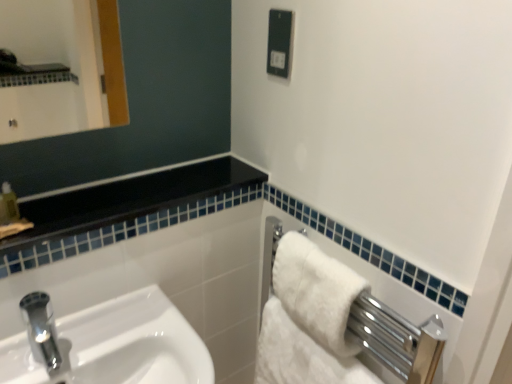
In order to face white fluffy bath towel at right, the 1th bath towel viewed from the top, should I rotate leftwards or rightwards?

Turn right approximately 8.119 degrees to face it.

Find the location of a particular element. The image size is (512, 384). black plastic electric outlet at upper center is located at coordinates (279, 42).

Where is `black glossy balustrade at upper left`? black glossy balustrade at upper left is located at coordinates (128, 200).

Find the location of a particular element. white fluffy bath towel at right, which is counted as the 2th bath towel, starting from the bottom is located at coordinates (316, 291).

Which bath towel is the 1st one when counting from the back of the black glossy balustrade at upper left? Please provide its 2D coordinates.

[(316, 291)]

Considering the relative positions of white fluffy bath towel at right, the 1th bath towel viewed from the top, and black glossy balustrade at upper left in the image provided, is white fluffy bath towel at right, the 1th bath towel viewed from the top, behind black glossy balustrade at upper left?

Yes, white fluffy bath towel at right, the 1th bath towel viewed from the top, is further from the viewer.

Is white fluffy bath towel at right, the 1th bath towel viewed from the top, facing towards black glossy balustrade at upper left?

No.

Which of these two, white fluffy bath towel at right, which is counted as the 2th bath towel, starting from the bottom, or black glossy balustrade at upper left, is smaller?

Smaller between the two is white fluffy bath towel at right, which is counted as the 2th bath towel, starting from the bottom.

From the image's perspective, is white glossy sink at lower left on top of black plastic electric outlet at upper center?

No, from the image's perspective, white glossy sink at lower left is not over black plastic electric outlet at upper center.

From a real-world perspective, is white glossy sink at lower left positioned under black plastic electric outlet at upper center based on gravity?

Indeed, from a real-world perspective, white glossy sink at lower left is positioned beneath black plastic electric outlet at upper center.

Is white glossy sink at lower left completely or partially outside of black plastic electric outlet at upper center?

white glossy sink at lower left is positioned outside black plastic electric outlet at upper center.

In the scene shown: Who is more distant, white glossy sink at lower left or black plastic electric outlet at upper center?

black plastic electric outlet at upper center is more distant.

Between white glossy sink at lower left and white fluffy bath towel at right, the second bath towel viewed from the top, which one has larger width?

white glossy sink at lower left is wider.

From a real-world perspective, is white glossy sink at lower left located beneath white fluffy bath towel at right, positioned as the 1th bath towel in bottom-to-top order?

Actually, white glossy sink at lower left is physically above white fluffy bath towel at right, positioned as the 1th bath towel in bottom-to-top order, in the real world.

Is white glossy sink at lower left directly adjacent to white fluffy bath towel at right, positioned as the 1th bath towel in bottom-to-top order?

white glossy sink at lower left and white fluffy bath towel at right, positioned as the 1th bath towel in bottom-to-top order, are clearly separated.

Between white glossy sink at lower left and white fluffy bath towel at right, the second bath towel viewed from the top, which one has less height?

white fluffy bath towel at right, the second bath towel viewed from the top.

From a real-world perspective, which object stands above the other?

From a 3D spatial view, black glossy balustrade at upper left is above.

Is white fluffy bath towel at right, the second bath towel viewed from the top, placed right next to black glossy balustrade at upper left?

white fluffy bath towel at right, the second bath towel viewed from the top, and black glossy balustrade at upper left are clearly separated.

In the scene shown: Which object is thinner, white fluffy bath towel at right, the second bath towel viewed from the top, or black glossy balustrade at upper left?

white fluffy bath towel at right, the second bath towel viewed from the top, is thinner.

How different are the orientations of white fluffy bath towel at right, the second bath towel viewed from the top, and black glossy balustrade at upper left in degrees?

The angle between the facing direction of white fluffy bath towel at right, the second bath towel viewed from the top, and the facing direction of black glossy balustrade at upper left is 89.7 degrees.

Is white glossy sink at lower left positioned beyond the bounds of white fluffy bath towel at right, the 1th bath towel viewed from the top?

Indeed, white glossy sink at lower left is completely outside white fluffy bath towel at right, the 1th bath towel viewed from the top.

Is white glossy sink at lower left taller than white fluffy bath towel at right, the 1th bath towel viewed from the top?

Yes, white glossy sink at lower left is taller than white fluffy bath towel at right, the 1th bath towel viewed from the top.

Based on their sizes in the image, would you say white glossy sink at lower left is bigger or smaller than white fluffy bath towel at right, which is counted as the 2th bath towel, starting from the bottom?

Clearly, white glossy sink at lower left is larger in size than white fluffy bath towel at right, which is counted as the 2th bath towel, starting from the bottom.

Would you say black plastic electric outlet at upper center is to the left or to the right of white fluffy bath towel at right, positioned as the 1th bath towel in bottom-to-top order, in the picture?

black plastic electric outlet at upper center is to the left of white fluffy bath towel at right, positioned as the 1th bath towel in bottom-to-top order.

There is a black plastic electric outlet at upper center. At what (x,y) coordinates should I click in order to perform the action: click on the 2nd bath towel below it (from the image's perspective). Please return your answer as a coordinate pair (x, y). Looking at the image, I should click on [300, 354].

Which object is wider, black plastic electric outlet at upper center or white fluffy bath towel at right, the second bath towel viewed from the top?

white fluffy bath towel at right, the second bath towel viewed from the top.

Is white fluffy bath towel at right, the second bath towel viewed from the top, positioned behind white fluffy bath towel at right, which is counted as the 2th bath towel, starting from the bottom?

Yes, white fluffy bath towel at right, the second bath towel viewed from the top, is further from the camera.

Which point is more forward, (307, 381) or (318, 319)?

The point (318, 319) is closer.

From the image's perspective, is white fluffy bath towel at right, the second bath towel viewed from the top, above or below white fluffy bath towel at right, the 1th bath towel viewed from the top?

From the image's perspective, white fluffy bath towel at right, the second bath towel viewed from the top, appears below white fluffy bath towel at right, the 1th bath towel viewed from the top.

Considering the positions of objects white fluffy bath towel at right, positioned as the 1th bath towel in bottom-to-top order, and white fluffy bath towel at right, the 1th bath towel viewed from the top, in the image provided, who is more to the right, white fluffy bath towel at right, positioned as the 1th bath towel in bottom-to-top order, or white fluffy bath towel at right, the 1th bath towel viewed from the top,?

Positioned to the right is white fluffy bath towel at right, the 1th bath towel viewed from the top.

Where is `balustrade above the white fluffy bath towel at right, the 1th bath towel viewed from the top (from a real-world perspective)`? balustrade above the white fluffy bath towel at right, the 1th bath towel viewed from the top (from a real-world perspective) is located at coordinates (128, 200).

Find the location of a particular element. electric outlet located behind the white glossy sink at lower left is located at coordinates click(279, 42).

From the image, which object appears to be farther from black glossy balustrade at upper left, white glossy sink at lower left or black plastic electric outlet at upper center?

black plastic electric outlet at upper center.

When comparing their distances from white fluffy bath towel at right, positioned as the 1th bath towel in bottom-to-top order, does black glossy balustrade at upper left or white glossy sink at lower left seem closer?

white glossy sink at lower left lies closer to white fluffy bath towel at right, positioned as the 1th bath towel in bottom-to-top order, than the other object.

Which object lies further to the anchor point white fluffy bath towel at right, the second bath towel viewed from the top, white fluffy bath towel at right, the 1th bath towel viewed from the top, or white glossy sink at lower left?

Among the two, white glossy sink at lower left is located further to white fluffy bath towel at right, the second bath towel viewed from the top.

When comparing their distances from black plastic electric outlet at upper center, does white fluffy bath towel at right, which is counted as the 2th bath towel, starting from the bottom, or white glossy sink at lower left seem closer?

white fluffy bath towel at right, which is counted as the 2th bath towel, starting from the bottom.

From the image, which object appears to be nearer to white fluffy bath towel at right, positioned as the 1th bath towel in bottom-to-top order, white glossy sink at lower left or black glossy balustrade at upper left?

The object closer to white fluffy bath towel at right, positioned as the 1th bath towel in bottom-to-top order, is white glossy sink at lower left.

When comparing their distances from black glossy balustrade at upper left, does white fluffy bath towel at right, positioned as the 1th bath towel in bottom-to-top order, or white fluffy bath towel at right, which is counted as the 2th bath towel, starting from the bottom, seem closer?

white fluffy bath towel at right, which is counted as the 2th bath towel, starting from the bottom, is positioned closer to the anchor black glossy balustrade at upper left.

When comparing their distances from black plastic electric outlet at upper center, does white fluffy bath towel at right, which is counted as the 2th bath towel, starting from the bottom, or white fluffy bath towel at right, the second bath towel viewed from the top, seem further?

The object further to black plastic electric outlet at upper center is white fluffy bath towel at right, the second bath towel viewed from the top.

Which object lies further to the anchor point white fluffy bath towel at right, the 1th bath towel viewed from the top, white glossy sink at lower left or white fluffy bath towel at right, positioned as the 1th bath towel in bottom-to-top order?

white glossy sink at lower left is positioned further to the anchor white fluffy bath towel at right, the 1th bath towel viewed from the top.

The width and height of the screenshot is (512, 384). In order to click on sink between black glossy balustrade at upper left and white fluffy bath towel at right, positioned as the 1th bath towel in bottom-to-top order, from top to bottom in this screenshot , I will do `click(117, 345)`.

Image resolution: width=512 pixels, height=384 pixels. What are the coordinates of `bath towel that lies between black glossy balustrade at upper left and white fluffy bath towel at right, positioned as the 1th bath towel in bottom-to-top order, from top to bottom` in the screenshot? It's located at (316, 291).

The image size is (512, 384). I want to click on bath towel between black plastic electric outlet at upper center and white fluffy bath towel at right, the second bath towel viewed from the top, in the vertical direction, so click(316, 291).

At what (x,y) coordinates should I click in order to perform the action: click on balustrade between black plastic electric outlet at upper center and white fluffy bath towel at right, which is counted as the 2th bath towel, starting from the bottom, in the up-down direction. Please return your answer as a coordinate pair (x, y). Looking at the image, I should click on (128, 200).